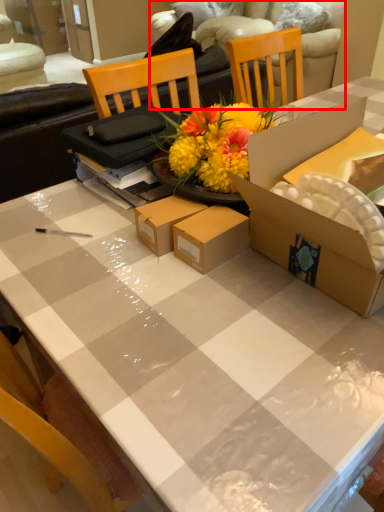
Question: From the image, what is the correct spatial relationship of couch (annotated by the red box) in relation to box?

Choices:
 (A) right
 (B) left

Answer: (A)